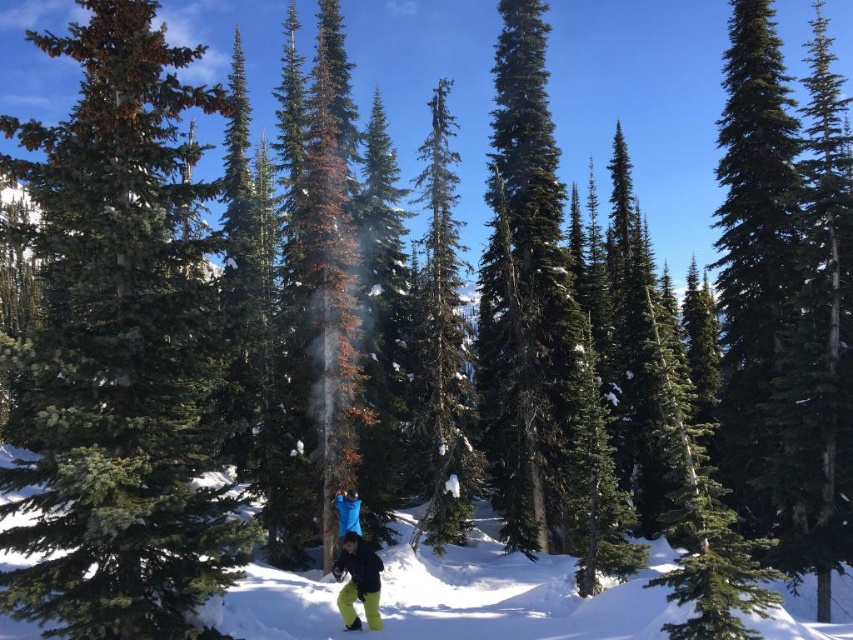
You are planning to take a photo of the green matte tree at center and the white powdery snow at center in the winter forest scene. Which object is positioned higher in the image?

The green matte tree at center is located above the white powdery snow at center, so it is positioned higher in the image.